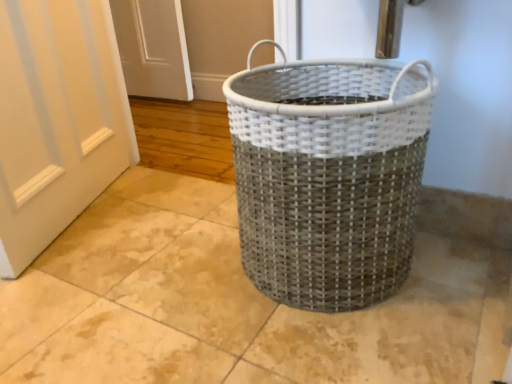
I want to click on vacant area that lies to the right of white painted wood door at left, so click(x=167, y=214).